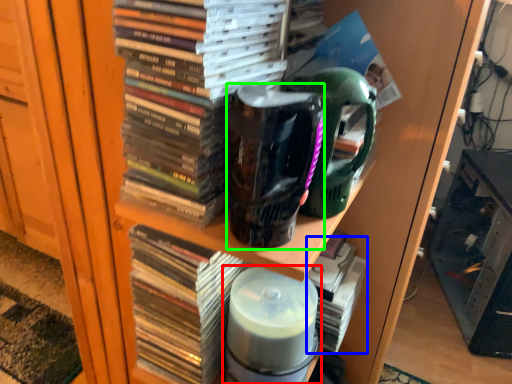
Question: Which object is the farthest from bottle (highlighted by a red box)? Choose among these: book (highlighted by a blue box) or mug (highlighted by a green box).

Choices:
 (A) book
 (B) mug

Answer: (B)